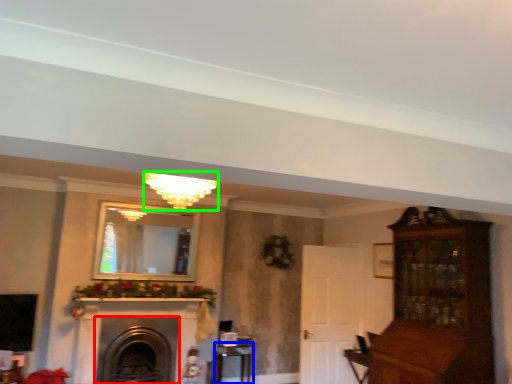
Question: Which object is the closest to the fireplace (highlighted by a red box)? Choose among these: table (highlighted by a blue box) or light fixture (highlighted by a green box).

Choices:
 (A) table
 (B) light fixture

Answer: (A)